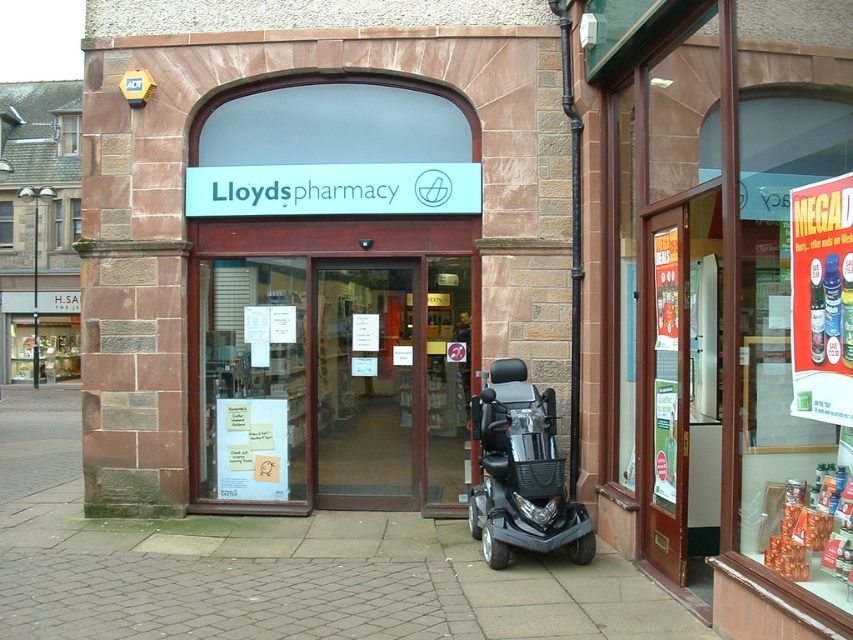
You are a delivery person trying to park your black plastic mobility scooter at lower center near the gray brick pavement at center. Can you park it on the pavement?

The gray brick pavement at center is below the black plastic mobility scooter at lower center, which means the scooter is already parked on the pavement.

You are standing in front of the pharmacy and want to step onto the gray brick pavement at center. Can you walk through the transparent glass door at center to reach it?

The transparent glass door at center is larger than the gray brick pavement at center, so you cannot walk through the transparent glass door at center to reach the gray brick pavement at center because the door occupies more space.

You are standing in front of the pharmacy and want to step onto the gray brick pavement at center to take a photo. Is the transparent glass door at center blocking your path?

The gray brick pavement at center is closer to the viewer than the transparent glass door at center, so the transparent glass door at center is behind the gray brick pavement at center and not blocking your path.